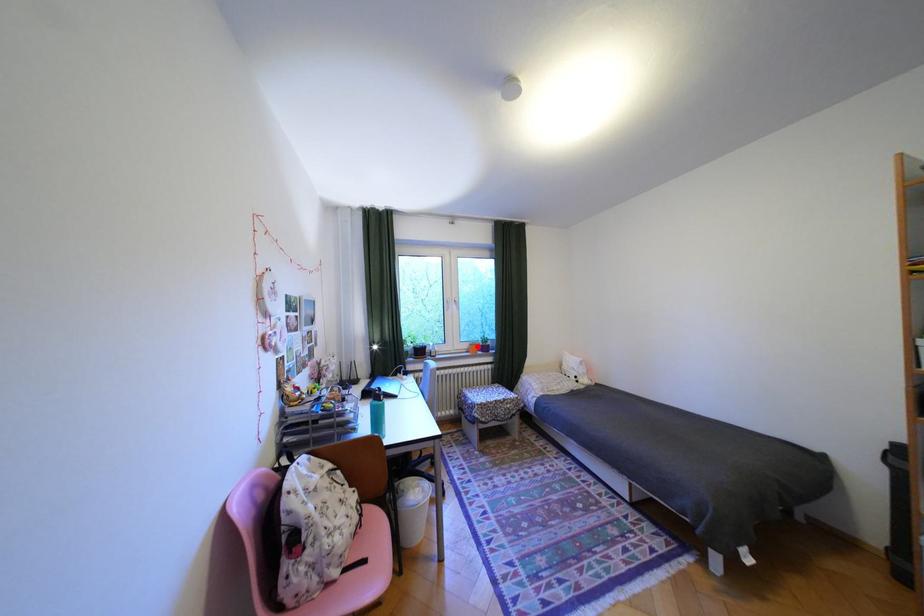
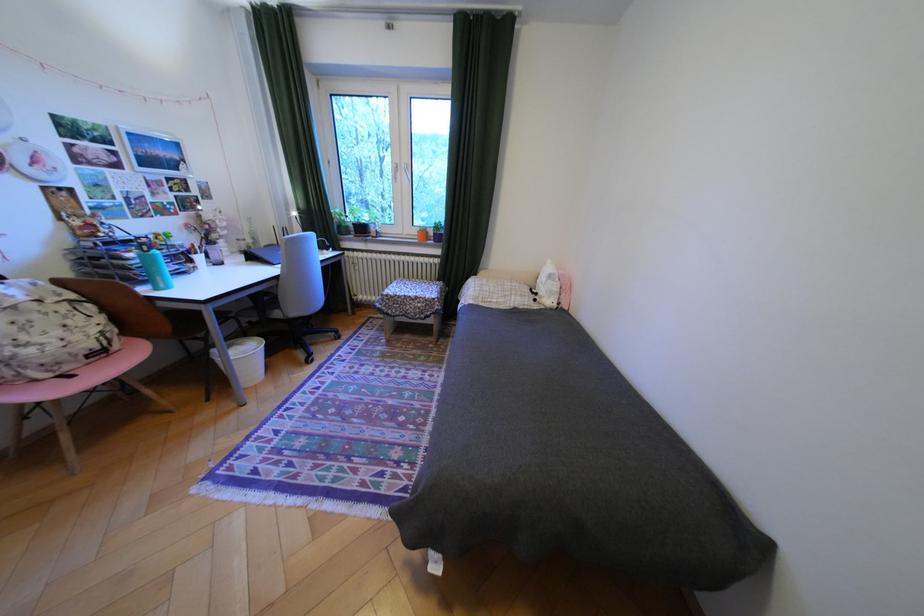
Question: I am providing you with two images of the same scene from different viewpoints. A red point is marked on the first image. At the location where the point appears in image 1, is it still visible in image 2?

Choices:
 (A) Yes
 (B) No

Answer: (A)